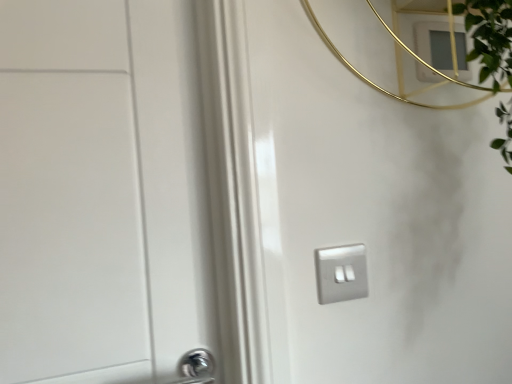
Image resolution: width=512 pixels, height=384 pixels. I want to click on satin silver switch at center, so click(x=341, y=273).

Image resolution: width=512 pixels, height=384 pixels. What do you see at coordinates (341, 273) in the screenshot? I see `satin silver switch at center` at bounding box center [341, 273].

You are a GUI agent. You are given a task and a screenshot of the screen. Output one action in this format:
    pyautogui.click(x=<x>, y=<y>)
    Task: Click on the satin silver switch at center
    This screenshot has height=384, width=512.
    Given the screenshot: What is the action you would take?
    pyautogui.click(x=341, y=273)